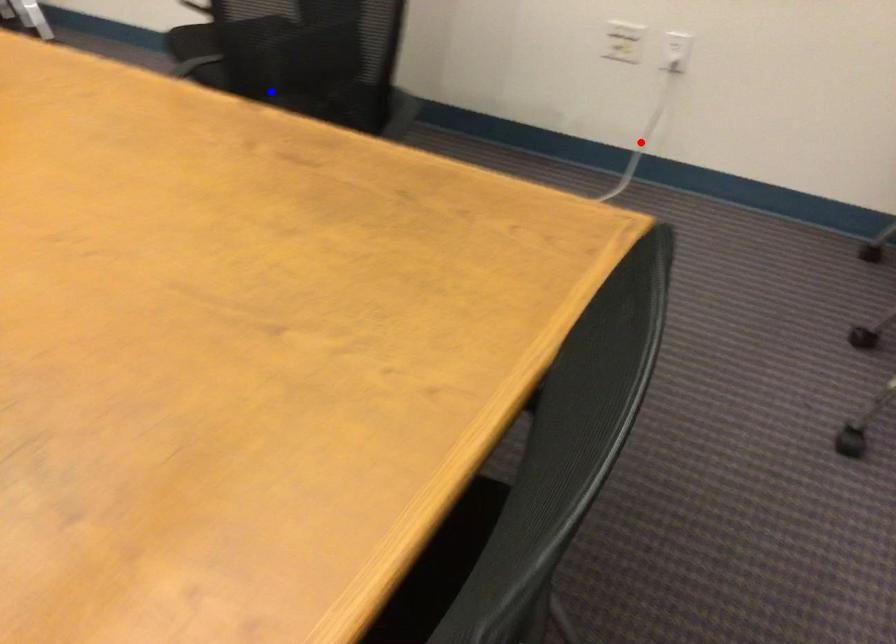
Question: In the image, two points are highlighted. Which point is nearer to the camera? Reply with the corresponding letter.

Choices:
 (A) blue point
 (B) red point

Answer: (A)